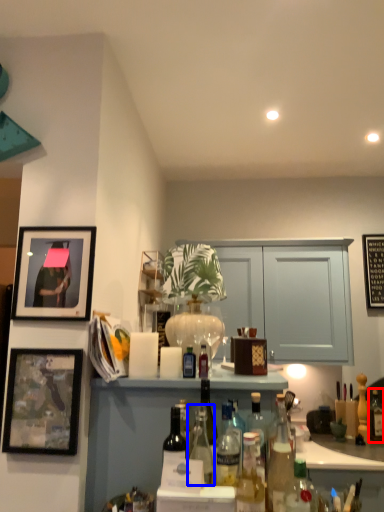
Question: Which point is further to the camera, bottle (highlighted by a red box) or bottle (highlighted by a blue box)?

Choices:
 (A) bottle
 (B) bottle

Answer: (A)